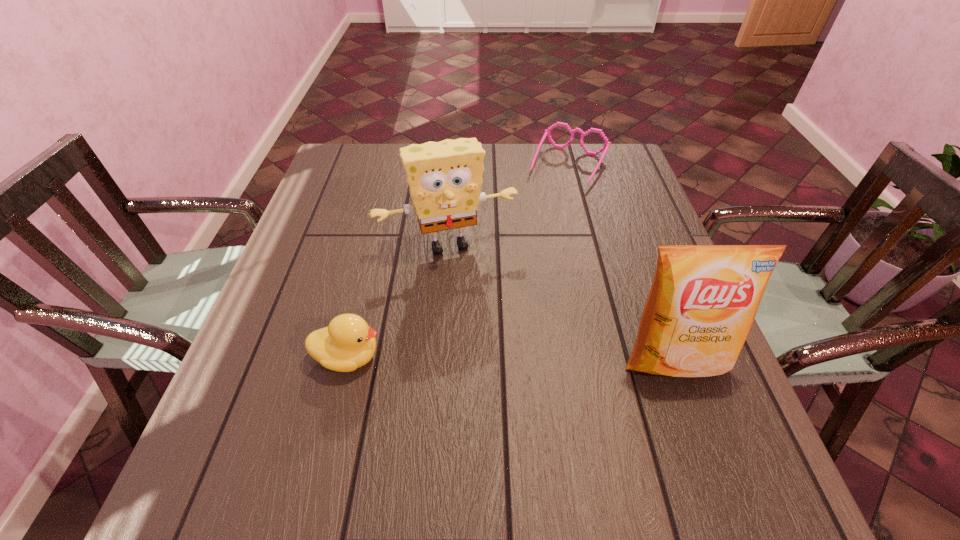
At what (x,y) coordinates should I click in order to perform the action: click on free spot on the desktop that is between the third tallest object and the crisp (potato chip) and is positioned on the face of the third nearest object. Please return your answer as a coordinate pair (x, y). The height and width of the screenshot is (540, 960). Looking at the image, I should click on (487, 359).

This screenshot has width=960, height=540. Identify the location of free space on the desktop that is between the third tallest object and the crisp (potato chip) and is positioned on the arms of the farthest object. (468, 359).